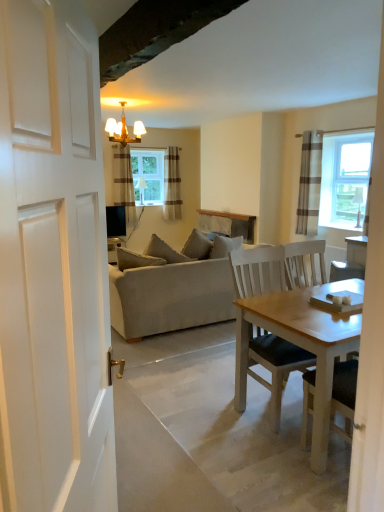
The height and width of the screenshot is (512, 384). In order to click on clear glass window at center in this screenshot , I will do `click(148, 176)`.

This screenshot has height=512, width=384. I want to click on brown striped curtain at upper center, acting as the 3th curtain starting from the front, so click(172, 184).

Identify the location of brown striped curtain at right, positioned as the 3th curtain in left-to-right order. The height and width of the screenshot is (512, 384). (309, 183).

What do you see at coordinates (309, 183) in the screenshot? I see `brown striped curtain at right, which is counted as the third curtain, starting from the back` at bounding box center [309, 183].

Where is `striped fabric curtain at center, which appears as the first curtain when viewed from the left`? This screenshot has height=512, width=384. striped fabric curtain at center, which appears as the first curtain when viewed from the left is located at coordinates (123, 182).

Where is `gold metallic chandelier at upper center`? This screenshot has width=384, height=512. gold metallic chandelier at upper center is located at coordinates (124, 129).

Does beige fabric couch at center appear on the left side of brown striped curtain at upper center, the 2th curtain in the left-to-right sequence?

No, beige fabric couch at center is not to the left of brown striped curtain at upper center, the 2th curtain in the left-to-right sequence.

From a real-world perspective, which is physically above, beige fabric couch at center or brown striped curtain at upper center, the 2th curtain in the left-to-right sequence?

From a 3D spatial view, brown striped curtain at upper center, the 2th curtain in the left-to-right sequence, is above.

Considering the relative sizes of beige fabric couch at center and brown striped curtain at upper center, the 2th curtain in the left-to-right sequence, in the image provided, is beige fabric couch at center wider than brown striped curtain at upper center, the 2th curtain in the left-to-right sequence,?

Yes.

Is beige fabric couch at center facing towards brown striped curtain at upper center, acting as the 3th curtain starting from the front?

Yes, beige fabric couch at center is oriented towards brown striped curtain at upper center, acting as the 3th curtain starting from the front.

Does clear glass window at center turn towards gold metallic chandelier at upper center?

No, clear glass window at center is not oriented towards gold metallic chandelier at upper center.

Looking at the image, does clear glass window at center seem bigger or smaller compared to gold metallic chandelier at upper center?

In the image, clear glass window at center appears to be smaller than gold metallic chandelier at upper center.

Is clear glass window at center not close to gold metallic chandelier at upper center?

clear glass window at center is actually quite close to gold metallic chandelier at upper center.

This screenshot has width=384, height=512. What are the coordinates of `window behind the gold metallic chandelier at upper center` in the screenshot? It's located at (148, 176).

Is brown striped curtain at upper center, the 1th curtain when ordered from back to front, facing away from beige fabric couch at center?

No.

From a real-world perspective, relative to beige fabric couch at center, is brown striped curtain at upper center, the 2th curtain in the left-to-right sequence, vertically above or below?

Clearly, from a real-world perspective, brown striped curtain at upper center, the 2th curtain in the left-to-right sequence, is above beige fabric couch at center.

Looking at this image, who is shorter, brown striped curtain at upper center, the 1th curtain when ordered from back to front, or beige fabric couch at center?

beige fabric couch at center.

Can you confirm if brown striped curtain at upper center, the 1th curtain when ordered from back to front, is shorter than striped fabric curtain at center, the second curtain when ordered from front to back?

Indeed, brown striped curtain at upper center, the 1th curtain when ordered from back to front, has a lesser height compared to striped fabric curtain at center, the second curtain when ordered from front to back.

Between point (178, 181) and point (120, 152), which one is positioned behind?

The point (178, 181) is behind.

From a real-world perspective, which object stands above the other?

In real-world perspective, striped fabric curtain at center, marked as the 2th curtain in a back-to-front arrangement, is above.

Considering the relative positions of brown striped curtain at upper center, acting as the 3th curtain starting from the front, and striped fabric curtain at center, the second curtain when ordered from front to back, in the image provided, is brown striped curtain at upper center, acting as the 3th curtain starting from the front, to the left or to the right of striped fabric curtain at center, the second curtain when ordered from front to back,?

brown striped curtain at upper center, acting as the 3th curtain starting from the front, is positioned on striped fabric curtain at center, the second curtain when ordered from front to back,'s right side.

How far apart are brown striped curtain at right, positioned as the 3th curtain in left-to-right order, and striped fabric curtain at center, marked as the 2th curtain in a back-to-front arrangement?

9.68 feet.

Can you confirm if brown striped curtain at right, arranged as the first curtain when viewed from the right, is positioned to the right of striped fabric curtain at center, which appears as the first curtain when viewed from the left?

Indeed, brown striped curtain at right, arranged as the first curtain when viewed from the right, is positioned on the right side of striped fabric curtain at center, which appears as the first curtain when viewed from the left.

Would you consider brown striped curtain at right, positioned as the 3th curtain in left-to-right order, to be distant from striped fabric curtain at center, the second curtain when ordered from front to back?

Yes.

Considering the sizes of brown striped curtain at right, which is counted as the third curtain, starting from the back, and striped fabric curtain at center, the second curtain when ordered from front to back, in the image, is brown striped curtain at right, which is counted as the third curtain, starting from the back, wider or thinner than striped fabric curtain at center, the second curtain when ordered from front to back,?

In the image, brown striped curtain at right, which is counted as the third curtain, starting from the back, appears to be more narrow than striped fabric curtain at center, the second curtain when ordered from front to back.

Measure the distance from clear glass window at center to beige fabric couch at center.

3.49 meters.

Is clear glass window at center facing towards beige fabric couch at center?

Yes.

Is clear glass window at center positioned in front of beige fabric couch at center?

No, it is not.

Is point (163, 194) closer to viewer compared to point (175, 327)?

No, (163, 194) is behind (175, 327).

Can you confirm if gold metallic chandelier at upper center is wider than striped fabric curtain at center, which appears as the first curtain when viewed from the left?

Yes, gold metallic chandelier at upper center is wider than striped fabric curtain at center, which appears as the first curtain when viewed from the left.

Does point (123, 133) come behind point (123, 169)?

No, (123, 133) is closer to viewer.

Is striped fabric curtain at center, the second curtain when ordered from front to back, at the back of gold metallic chandelier at upper center?

Correct, gold metallic chandelier at upper center is looking away from striped fabric curtain at center, the second curtain when ordered from front to back.

How different are the orientations of gold metallic chandelier at upper center and striped fabric curtain at center, the second curtain when ordered from front to back, in degrees?

They differ by 0.223 degrees in their facing directions.

From the image's perspective, which curtain is the 3rd one above the beige fabric couch at center? Please provide its 2D coordinates.

[(172, 184)]

This screenshot has width=384, height=512. In order to click on light fixture above the clear glass window at center (from a real-world perspective) in this screenshot , I will do `click(124, 129)`.

Which object lies nearer to the anchor point gold metallic chandelier at upper center, brown striped curtain at upper center, the 2th curtain in the left-to-right sequence, or clear glass window at center?

clear glass window at center is closer to gold metallic chandelier at upper center.

In the scene shown: When comparing their distances from brown striped curtain at upper center, the 1th curtain when ordered from back to front, does beige fabric couch at center or brown striped curtain at right, positioned as the 3th curtain in left-to-right order, seem closer?

brown striped curtain at right, positioned as the 3th curtain in left-to-right order, is positioned closer to the anchor brown striped curtain at upper center, the 1th curtain when ordered from back to front.

From the image, which object appears to be farther from gold metallic chandelier at upper center, beige fabric couch at center or striped fabric curtain at center, the second curtain when ordered from front to back?

The object further to gold metallic chandelier at upper center is beige fabric couch at center.

From the image, which object appears to be nearer to clear glass window at center, brown striped curtain at upper center, acting as the 3th curtain starting from the front, or brown striped curtain at right, the 1th curtain in the front-to-back sequence?

The object closer to clear glass window at center is brown striped curtain at upper center, acting as the 3th curtain starting from the front.

When comparing their distances from striped fabric curtain at center, marked as the 3th curtain in a right-to-left arrangement, does beige fabric couch at center or clear glass window at center seem closer?

Among the two, clear glass window at center is located nearer to striped fabric curtain at center, marked as the 3th curtain in a right-to-left arrangement.

When comparing their distances from clear glass window at center, does gold metallic chandelier at upper center or brown striped curtain at right, arranged as the first curtain when viewed from the right, seem closer?

The object closer to clear glass window at center is gold metallic chandelier at upper center.

From the image, which object appears to be farther from beige fabric couch at center, clear glass window at center or gold metallic chandelier at upper center?

clear glass window at center.

Considering their positions, is gold metallic chandelier at upper center positioned closer to brown striped curtain at upper center, the 1th curtain when ordered from back to front, than striped fabric curtain at center, the second curtain when ordered from front to back?

striped fabric curtain at center, the second curtain when ordered from front to back, is positioned closer to the anchor brown striped curtain at upper center, the 1th curtain when ordered from back to front.

Locate an element on the screen. light fixture between beige fabric couch at center and striped fabric curtain at center, which appears as the first curtain when viewed from the left, along the z-axis is located at coordinates (124, 129).

Image resolution: width=384 pixels, height=512 pixels. Identify the location of studio couch located between gold metallic chandelier at upper center and brown striped curtain at right, the 1th curtain in the front-to-back sequence, in the left-right direction. (170, 293).

At what (x,y) coordinates should I click in order to perform the action: click on light fixture located between striped fabric curtain at center, marked as the 2th curtain in a back-to-front arrangement, and brown striped curtain at right, positioned as the 3th curtain in left-to-right order, in the left-right direction. Please return your answer as a coordinate pair (x, y). Image resolution: width=384 pixels, height=512 pixels. Looking at the image, I should click on (124, 129).

What are the coordinates of `light fixture positioned between beige fabric couch at center and clear glass window at center from near to far` in the screenshot? It's located at (124, 129).